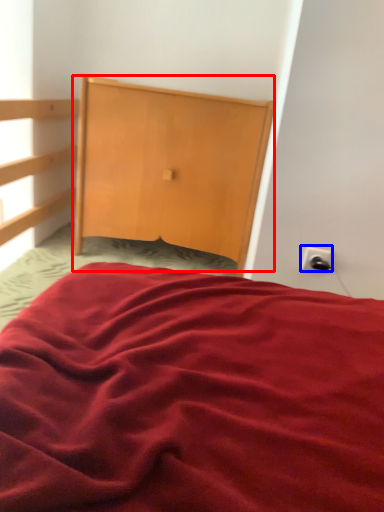
Question: Which of the following is the closest to the observer, dresser (highlighted by a red box) or electric outlet (highlighted by a blue box)?

Choices:
 (A) dresser
 (B) electric outlet

Answer: (B)